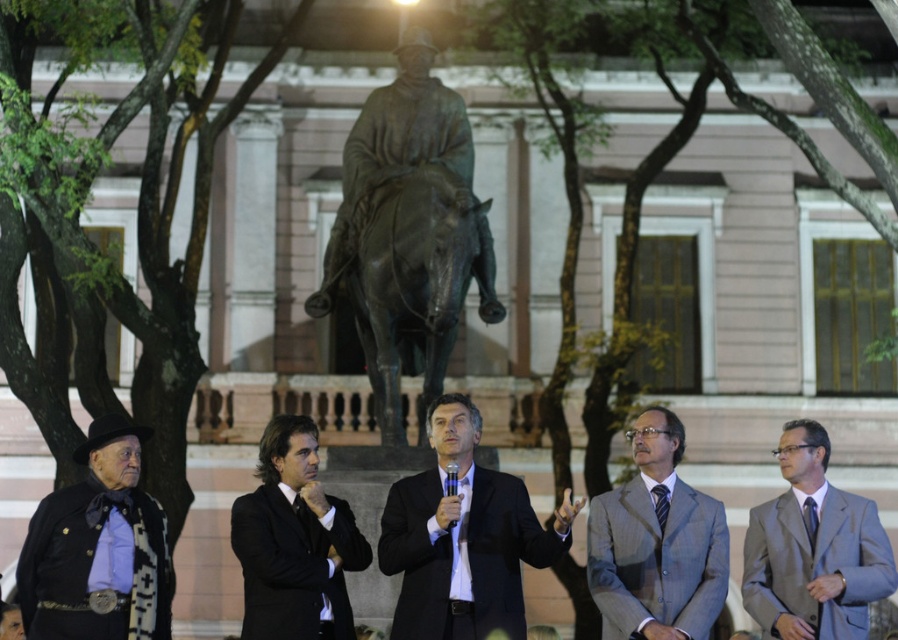
Question: Does bronze statue at center appear over striped silk tie at center?

Choices:
 (A) yes
 (B) no

Answer: (A)

Question: Which point is farther to the camera?

Choices:
 (A) bronze statue at center
 (B) gray textured suit at center
 (C) black satin suit at center

Answer: (A)

Question: Which point is closer to the camera?

Choices:
 (A) (151, 518)
 (B) (782, 445)

Answer: (A)

Question: Which of the following is the closest to the observer?

Choices:
 (A) (319, 488)
 (B) (780, 620)
 (C) (411, 323)

Answer: (A)

Question: Where is bronze statue at center located in relation to gray suit at center in the image?

Choices:
 (A) left
 (B) right

Answer: (A)

Question: Is matte black suit at center thinner than black satin suit at center?

Choices:
 (A) yes
 (B) no

Answer: (B)